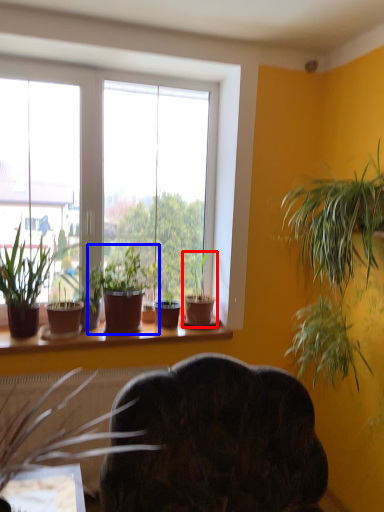
Question: Which of the following is the farthest to the observer, houseplant (highlighted by a red box) or houseplant (highlighted by a blue box)?

Choices:
 (A) houseplant
 (B) houseplant

Answer: (A)